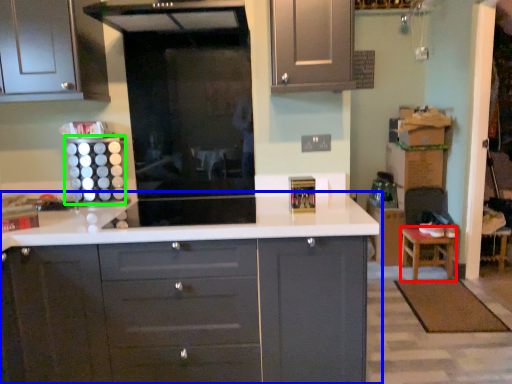
Question: Which is nearer to the stool (highlighted by a red box)? countertop (highlighted by a blue box) or appliance (highlighted by a green box).

Choices:
 (A) countertop
 (B) appliance

Answer: (A)